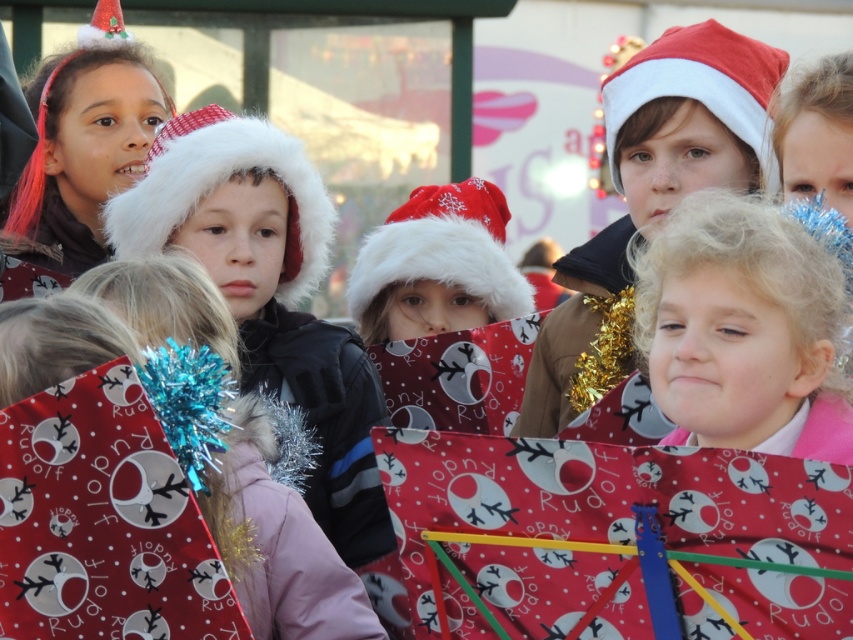
Question: Which point is closer to the camera taking this photo?

Choices:
 (A) (473, 627)
 (B) (401, 218)
 (C) (727, 330)

Answer: (A)

Question: Observing the image, what is the correct spatial positioning of blonde curly hair at center in reference to white fluffy santa hat at center?

Choices:
 (A) left
 (B) right

Answer: (B)

Question: Which is farther from the red fluffy santa hat at center?

Choices:
 (A) shiny red hairband at upper left
 (B) matte red santa hat at center
 (C) white fluffy hat at center

Answer: (C)

Question: Considering the relative positions of white fluffy hat at center and red matte santa hat at upper center in the image provided, where is white fluffy hat at center located with respect to red matte santa hat at upper center?

Choices:
 (A) below
 (B) above

Answer: (A)

Question: Which object is positioned closest to the white fluffy santa hat at center?

Choices:
 (A) red shiny wrapping paper at center
 (B) blonde curly hair at center
 (C) red matte santa hat at upper center

Answer: (C)

Question: Is shiny red hairband at upper left smaller than red fluffy santa hat at center?

Choices:
 (A) no
 (B) yes

Answer: (B)